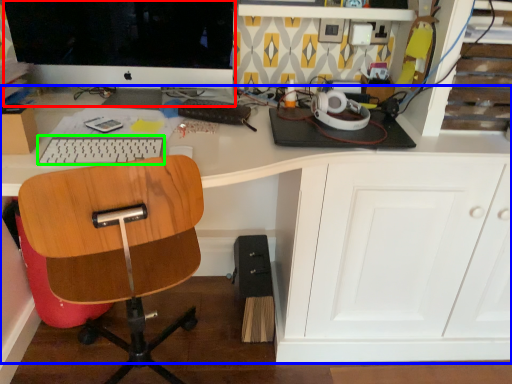
Question: Which is nearer to the computer monitor (highlighted by a red box)? desk (highlighted by a blue box) or keyboard (highlighted by a green box).

Choices:
 (A) desk
 (B) keyboard

Answer: (B)